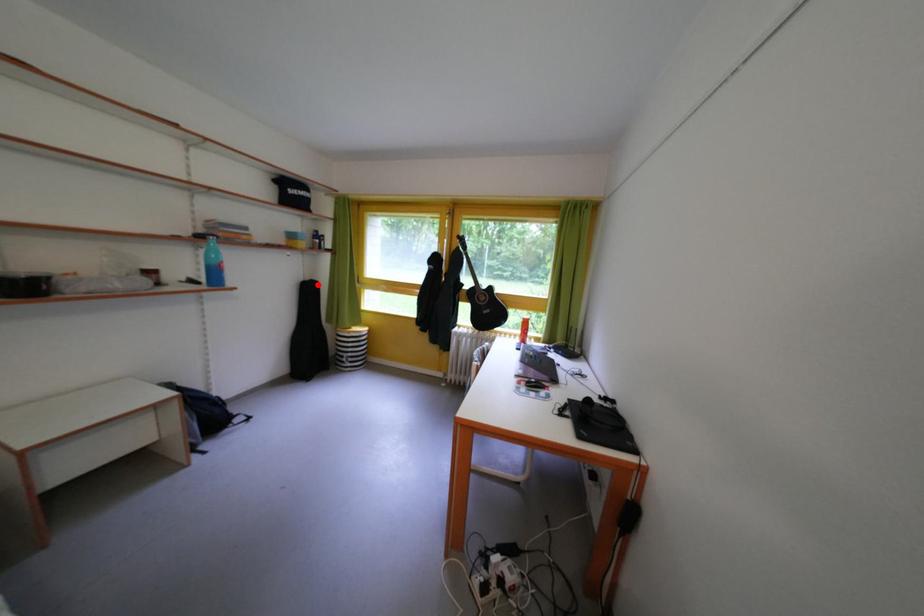
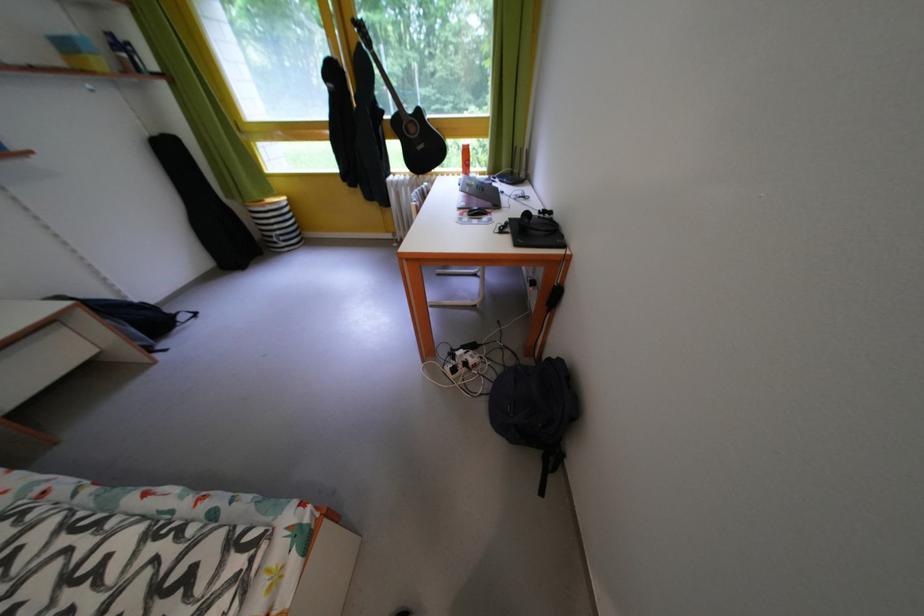
Locate, in the second image, the point that corresponds to the highlighted location in the first image.

(165, 139)